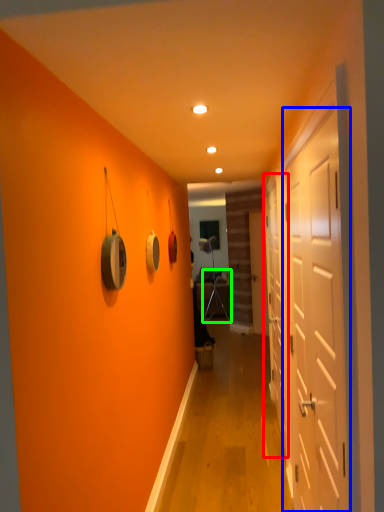
Question: Which object is positioned closest to door (highlighted by a red box)? Select from door (highlighted by a blue box) and armchair (highlighted by a green box).

Choices:
 (A) door
 (B) armchair

Answer: (A)